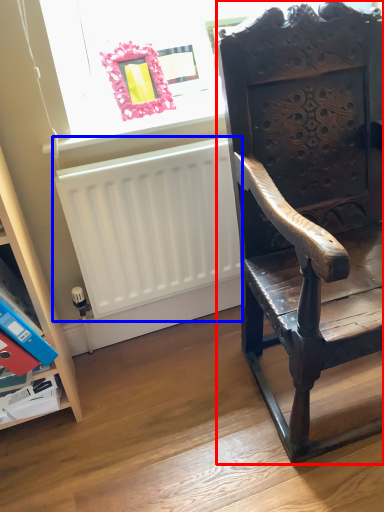
Question: Which object is further to the camera taking this photo, chair (highlighted by a red box) or radiator (highlighted by a blue box)?

Choices:
 (A) chair
 (B) radiator

Answer: (B)